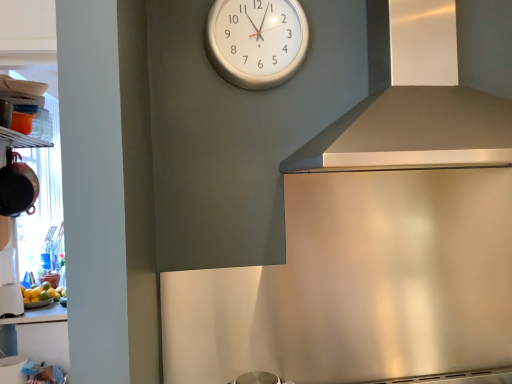
Question: Is satin silver exhaust hood at upper right to the right of white glossy cup at lower left, which ranks as the 2th appliance in top-to-bottom order, from the viewer's perspective?

Choices:
 (A) yes
 (B) no

Answer: (A)

Question: Considering the relative sizes of satin silver exhaust hood at upper right and white glossy cup at lower left, which ranks as the 2th appliance in top-to-bottom order, in the image provided, is satin silver exhaust hood at upper right wider than white glossy cup at lower left, which ranks as the 2th appliance in top-to-bottom order,?

Choices:
 (A) no
 (B) yes

Answer: (B)

Question: From a real-world perspective, is satin silver exhaust hood at upper right over white glossy cup at lower left, which ranks as the 2th appliance in top-to-bottom order?

Choices:
 (A) no
 (B) yes

Answer: (B)

Question: Can you confirm if satin silver exhaust hood at upper right is positioned to the left of white glossy cup at lower left, which is counted as the first appliance, starting from the bottom?

Choices:
 (A) no
 (B) yes

Answer: (A)

Question: Could you tell me if satin silver exhaust hood at upper right is facing white glossy cup at lower left, which ranks as the 2th appliance in top-to-bottom order?

Choices:
 (A) yes
 (B) no

Answer: (B)

Question: Is white glossy clock at upper center in front of or behind yellow matte bowl at lower left in the image?

Choices:
 (A) behind
 (B) front

Answer: (B)

Question: Is point (249, 18) positioned closer to the camera than point (37, 286)?

Choices:
 (A) closer
 (B) farther

Answer: (A)

Question: From the image's perspective, relative to yellow matte bowl at lower left, is white glossy clock at upper center above or below?

Choices:
 (A) above
 (B) below

Answer: (A)

Question: From a real-world perspective, is white glossy clock at upper center above or below yellow matte bowl at lower left?

Choices:
 (A) below
 (B) above

Answer: (B)

Question: In terms of width, does white glossy cup at lower left, which is counted as the first appliance, starting from the bottom, look wider or thinner when compared to matte black pot at left, the first appliance from the top?

Choices:
 (A) thin
 (B) wide

Answer: (A)

Question: From a real-world perspective, is white glossy cup at lower left, which ranks as the 2th appliance in top-to-bottom order, physically located above or below matte black pot at left, the first appliance from the top?

Choices:
 (A) below
 (B) above

Answer: (A)

Question: In the image, is white glossy cup at lower left, which is counted as the first appliance, starting from the bottom, positioned in front of or behind matte black pot at left, the 2th appliance in the bottom-to-top sequence?

Choices:
 (A) behind
 (B) front

Answer: (A)

Question: Is white glossy cup at lower left, which ranks as the 2th appliance in top-to-bottom order, inside or outside of matte black pot at left, the first appliance from the top?

Choices:
 (A) inside
 (B) outside

Answer: (B)

Question: From a real-world perspective, is white glossy cup at lower left, which is counted as the first appliance, starting from the bottom, above or below satin silver exhaust hood at upper right?

Choices:
 (A) above
 (B) below

Answer: (B)

Question: In terms of height, does white glossy cup at lower left, which is counted as the first appliance, starting from the bottom, look taller or shorter compared to satin silver exhaust hood at upper right?

Choices:
 (A) short
 (B) tall

Answer: (A)